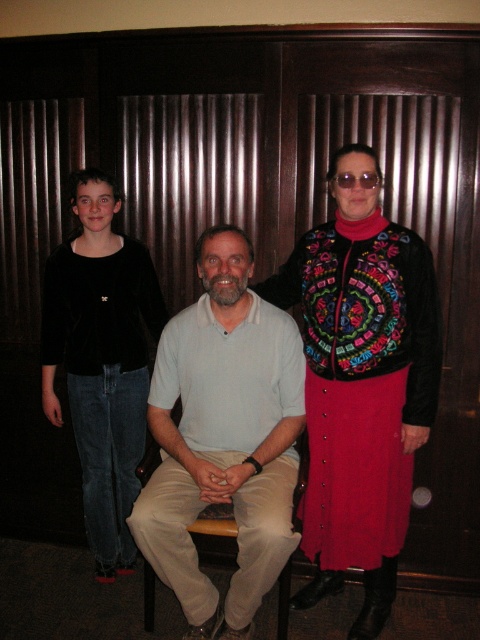
Who is shorter, multicolored embroidered vest at center or transparent plastic goggles at upper center?

With less height is transparent plastic goggles at upper center.

Between multicolored embroidered vest at center and transparent plastic goggles at upper center, which one appears on the right side from the viewer's perspective?

Positioned to the right is transparent plastic goggles at upper center.

Locate an element on the screen. The height and width of the screenshot is (640, 480). multicolored embroidered vest at center is located at coordinates (360, 385).

Does light beige cotton shirt at center have a lesser width compared to black velvet shirt at left?

No.

Between light beige cotton shirt at center and black velvet shirt at left, which one appears on the right side from the viewer's perspective?

light beige cotton shirt at center

Which is behind, point (259, 532) or point (70, 269)?

The point (70, 269) is more distant.

Locate an element on the screen. This screenshot has width=480, height=640. light beige cotton shirt at center is located at coordinates (224, 435).

Which of these two, light beige cotton shirt at center or transparent plastic goggles at upper center, stands taller?

light beige cotton shirt at center

Based on the photo, can you confirm if light beige cotton shirt at center is positioned to the left of transparent plastic goggles at upper center?

Correct, you'll find light beige cotton shirt at center to the left of transparent plastic goggles at upper center.

Which is behind, point (170, 460) or point (372, 188)?

Point (170, 460)

At what (x,y) coordinates should I click in order to perform the action: click on light beige cotton shirt at center. Please return your answer as a coordinate pair (x, y). This screenshot has width=480, height=640. Looking at the image, I should click on (224, 435).